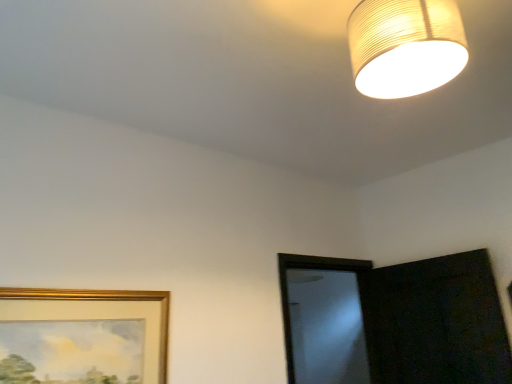
Question: Is gold-framed picture at lower left smaller than matte paper lampshade at upper right?

Choices:
 (A) yes
 (B) no

Answer: (A)

Question: Is gold-framed picture at lower left closer to camera compared to matte paper lampshade at upper right?

Choices:
 (A) yes
 (B) no

Answer: (B)

Question: From a real-world perspective, is gold-framed picture at lower left over matte paper lampshade at upper right?

Choices:
 (A) yes
 (B) no

Answer: (B)

Question: From a real-world perspective, does gold-framed picture at lower left sit lower than matte paper lampshade at upper right?

Choices:
 (A) no
 (B) yes

Answer: (B)

Question: Can you confirm if gold-framed picture at lower left is taller than matte paper lampshade at upper right?

Choices:
 (A) no
 (B) yes

Answer: (B)

Question: Can you confirm if gold-framed picture at lower left is positioned to the left of matte paper lampshade at upper right?

Choices:
 (A) no
 (B) yes

Answer: (B)

Question: From the image's perspective, does matte paper lampshade at upper right appear higher than gold-framed picture at lower left?

Choices:
 (A) no
 (B) yes

Answer: (B)

Question: Is gold-framed picture at lower left inside matte paper lampshade at upper right?

Choices:
 (A) no
 (B) yes

Answer: (A)

Question: Are matte paper lampshade at upper right and gold-framed picture at lower left located far from each other?

Choices:
 (A) no
 (B) yes

Answer: (B)

Question: Considering the relative sizes of matte paper lampshade at upper right and gold-framed picture at lower left in the image provided, is matte paper lampshade at upper right wider than gold-framed picture at lower left?

Choices:
 (A) yes
 (B) no

Answer: (A)

Question: Can you confirm if matte paper lampshade at upper right is thinner than gold-framed picture at lower left?

Choices:
 (A) no
 (B) yes

Answer: (A)

Question: From a real-world perspective, is matte paper lampshade at upper right physically above gold-framed picture at lower left?

Choices:
 (A) no
 (B) yes

Answer: (B)

Question: Considering the positions of matte paper lampshade at upper right and gold-framed picture at lower left in the image, is matte paper lampshade at upper right taller or shorter than gold-framed picture at lower left?

Choices:
 (A) short
 (B) tall

Answer: (A)